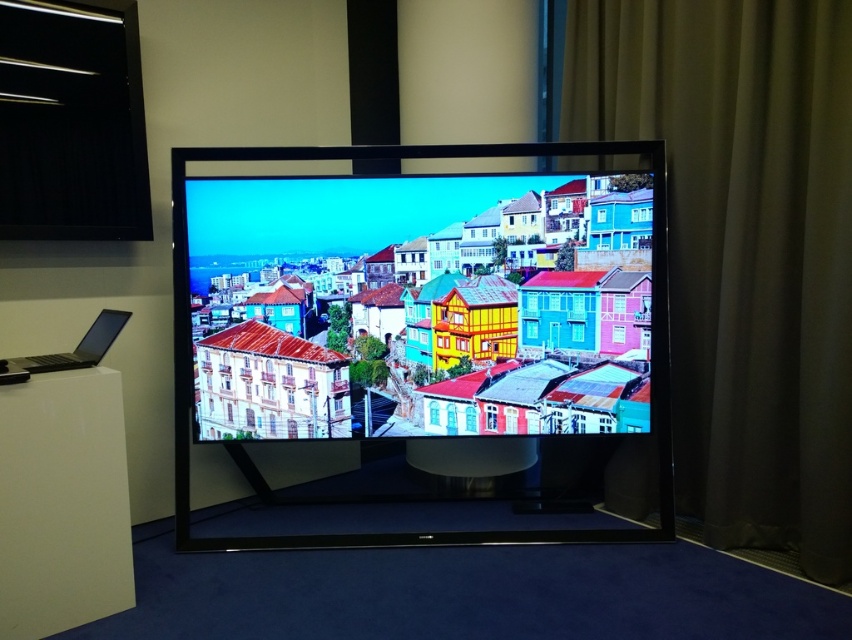
Based on the photo, who is more forward, (292, 348) or (60, 358)?

Point (60, 358) is more forward.

Does point (407, 205) come closer to viewer compared to point (76, 358)?

No, (407, 205) is behind (76, 358).

This screenshot has width=852, height=640. In order to click on matte glass screen at center in this screenshot , I will do `click(421, 305)`.

Does dark green fabric curtain at right lie behind satin black laptop at lower left?

Yes.

The image size is (852, 640). What do you see at coordinates (743, 248) in the screenshot?
I see `dark green fabric curtain at right` at bounding box center [743, 248].

The height and width of the screenshot is (640, 852). Identify the location of dark green fabric curtain at right. (743, 248).

Between matte glass screen at center and dark green fabric curtain at right, which one appears on the left side from the viewer's perspective?

matte glass screen at center

Is matte glass screen at center wider than dark green fabric curtain at right?

Yes, matte glass screen at center is wider than dark green fabric curtain at right.

This screenshot has height=640, width=852. Find the location of `matte glass screen at center`. matte glass screen at center is located at coordinates (421, 305).

Locate an element on the screen. The height and width of the screenshot is (640, 852). matte glass screen at center is located at coordinates click(x=421, y=305).